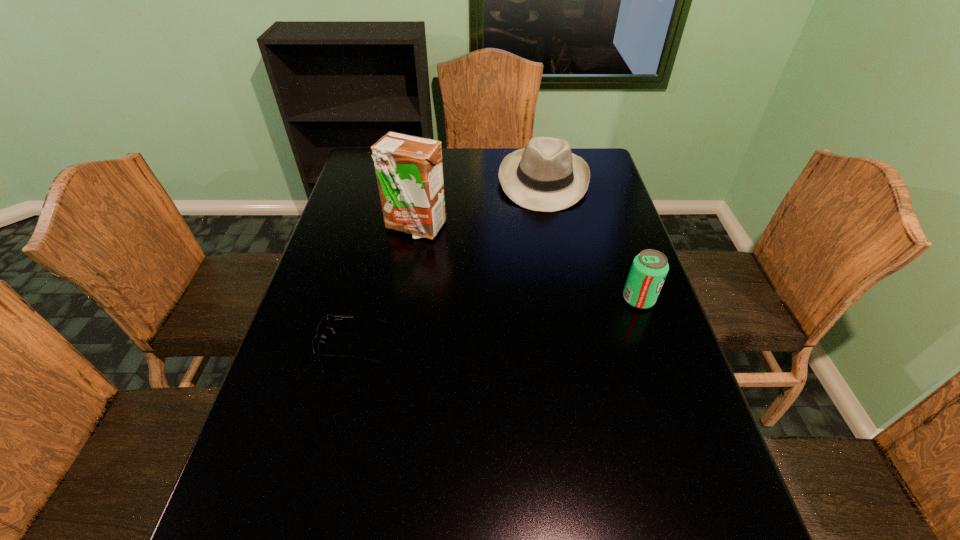
The image size is (960, 540). In order to click on vacant region at the far right corner of the desktop in this screenshot , I will do `click(572, 151)`.

The width and height of the screenshot is (960, 540). I want to click on free space between the pop soda and the nearest object, so click(495, 321).

Where is `empty space that is in between the sunglasses and the third farthest object`? The image size is (960, 540). empty space that is in between the sunglasses and the third farthest object is located at coordinates (495, 321).

The width and height of the screenshot is (960, 540). Find the location of `unoccupied position between the carton and the fedora`. unoccupied position between the carton and the fedora is located at coordinates (479, 204).

This screenshot has height=540, width=960. I want to click on vacant area between the fedora and the shortest object, so click(x=447, y=262).

In order to click on blank region between the sunglasses and the carton in this screenshot , I will do `click(384, 285)`.

Identify the location of unoccupied area between the second nearest object and the fedora. The height and width of the screenshot is (540, 960). (590, 240).

You are a GUI agent. You are given a task and a screenshot of the screen. Output one action in this format:
    pyautogui.click(x=<x>, y=<y>)
    Task: Click on the vacant area that lies between the fedora and the third farthest object
    Image resolution: width=960 pixels, height=540 pixels.
    Given the screenshot: What is the action you would take?
    pyautogui.click(x=590, y=240)

Locate an element on the screen. The image size is (960, 540). free space between the fedora and the third farthest object is located at coordinates (590, 240).

Locate an element on the screen. free space between the pop soda and the fedora is located at coordinates (590, 240).